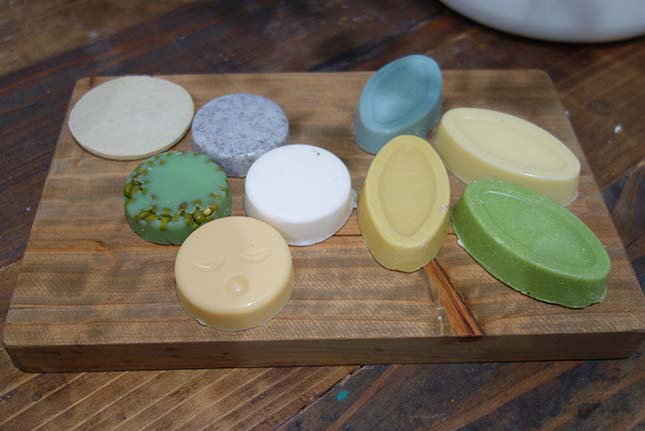
Where is `yellow soap`? The height and width of the screenshot is (431, 645). yellow soap is located at coordinates (415, 194), (495, 136), (251, 250).